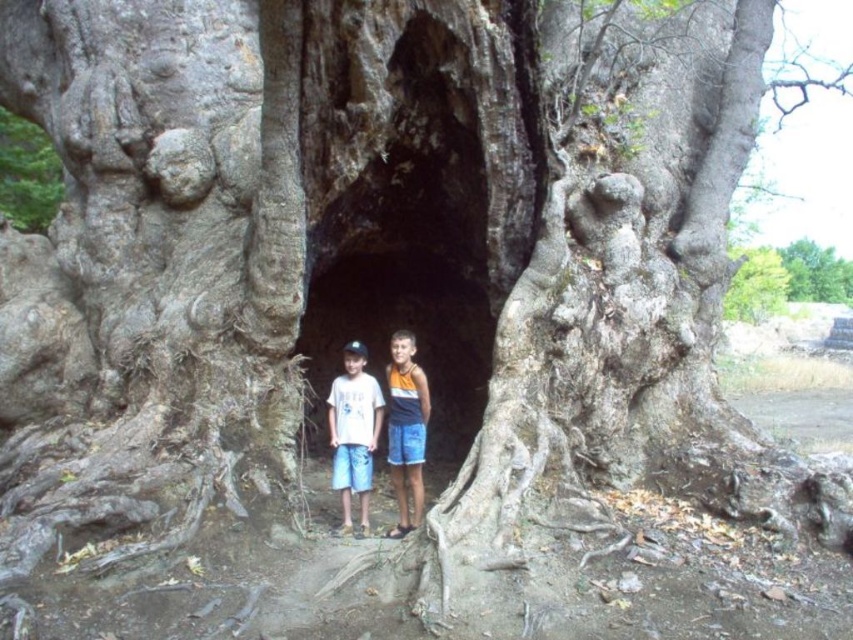
You are a photographer trying to capture the two children standing inside the hollow of the ancient tree. Based on the scene, which object from the following would you adjust your camera focus to ensure the children are in focus? The options are the white cotton shorts at center and the smooth gray bark at center. Please explain your reasoning.

The white cotton shorts at center is taller than the smooth gray bark at center. To ensure the children are in focus, adjust the camera focus to the white cotton shorts at center since it is the taller object and closer to the camera, making it the primary subject.

Based on the photo, you are a photographer taking a picture of the two children inside the hollow of the ancient tree. You notice the white cotton shorts at center and the smooth gray bark at center in your frame. Which object is positioned lower in the image?

The white cotton shorts at center is below smooth gray bark at center, so the white cotton shorts at center is positioned lower in the image.

You are a photographer trying to capture the children inside the hollow of the green leafy tree at upper center. To ensure both children wearing blue shorts at center are visible, should you adjust your camera angle to the left or right of the tree?

The blue shorts at center is positioned on the left side of green leafy tree at upper center, so to capture both children, you should adjust your camera angle to the right of the tree to ensure the child on the left is fully visible.